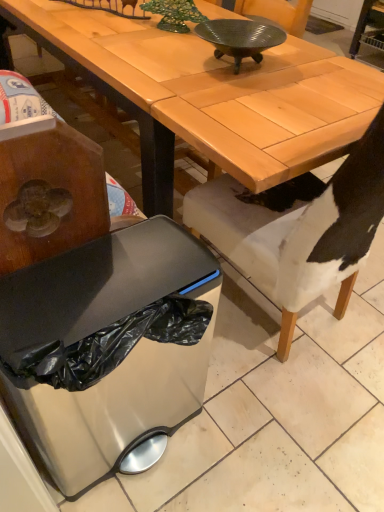
Question: Does metallic ribbed bowl at center lie in front of white fabric chair at lower right?

Choices:
 (A) no
 (B) yes

Answer: (A)

Question: Is metallic ribbed bowl at center positioned with its back to white fabric chair at lower right?

Choices:
 (A) no
 (B) yes

Answer: (A)

Question: Is metallic ribbed bowl at center taller than white fabric chair at lower right?

Choices:
 (A) no
 (B) yes

Answer: (A)

Question: From a real-world perspective, is metallic ribbed bowl at center under white fabric chair at lower right?

Choices:
 (A) no
 (B) yes

Answer: (A)

Question: Does metallic ribbed bowl at center have a smaller size compared to white fabric chair at lower right?

Choices:
 (A) yes
 (B) no

Answer: (A)

Question: Can you confirm if metallic ribbed bowl at center is positioned to the right of white fabric chair at lower right?

Choices:
 (A) no
 (B) yes

Answer: (A)

Question: From the image's perspective, is matte wood desk at center located above white fabric chair at lower right?

Choices:
 (A) no
 (B) yes

Answer: (B)

Question: Is the depth of matte wood desk at center less than that of white fabric chair at lower right?

Choices:
 (A) yes
 (B) no

Answer: (B)

Question: Does matte wood desk at center have a smaller size compared to white fabric chair at lower right?

Choices:
 (A) yes
 (B) no

Answer: (B)

Question: From the image's perspective, does matte wood desk at center appear lower than white fabric chair at lower right?

Choices:
 (A) yes
 (B) no

Answer: (B)

Question: From a real-world perspective, is matte wood desk at center located higher than white fabric chair at lower right?

Choices:
 (A) no
 (B) yes

Answer: (A)

Question: Is matte wood desk at center behind white fabric chair at lower right?

Choices:
 (A) no
 (B) yes

Answer: (B)

Question: Is matte wood desk at center positioned behind satin silver trash can at lower left?

Choices:
 (A) yes
 (B) no

Answer: (A)